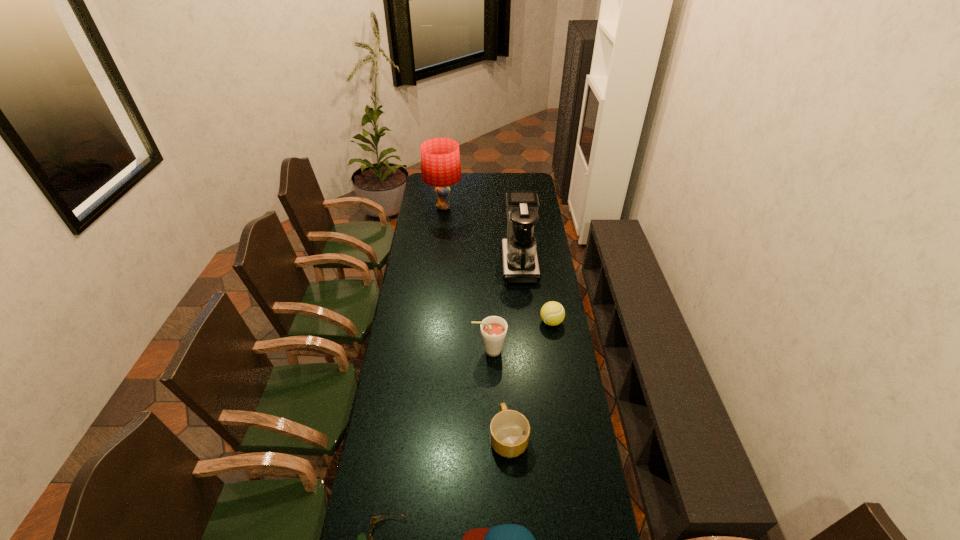
At what (x,y) coordinates should I click in order to perform the action: click on vacant space at the left edge of the desktop. Please return your answer as a coordinate pair (x, y). The width and height of the screenshot is (960, 540). Looking at the image, I should click on (424, 396).

Identify the location of vacant space at the right edge of the desktop. (566, 355).

Locate an element on the screen. Image resolution: width=960 pixels, height=540 pixels. free space that is in between the farthest object and the mug is located at coordinates (476, 322).

The height and width of the screenshot is (540, 960). I want to click on vacant space that is in between the farthest object and the second farthest object, so click(x=481, y=235).

The width and height of the screenshot is (960, 540). I want to click on unoccupied position between the fifth farthest object and the coffee maker, so click(514, 350).

The width and height of the screenshot is (960, 540). Find the location of `free space between the fifth farthest object and the tennis ball`. free space between the fifth farthest object and the tennis ball is located at coordinates (530, 379).

You are a GUI agent. You are given a task and a screenshot of the screen. Output one action in this format:
    pyautogui.click(x=<x>, y=<y>)
    Task: Click on the empty location between the third tallest object and the lampshade
    This screenshot has height=540, width=960.
    Given the screenshot: What is the action you would take?
    pyautogui.click(x=467, y=279)

This screenshot has width=960, height=540. Find the location of `object that is the fifth closest to the fifth farthest object`. object that is the fifth closest to the fifth farthest object is located at coordinates (519, 255).

You are a GUI agent. You are given a task and a screenshot of the screen. Output one action in this format:
    pyautogui.click(x=<x>, y=<y>)
    Task: Click on the object that is the third nearest to the third nearest object
    The width and height of the screenshot is (960, 540).
    Given the screenshot: What is the action you would take?
    pyautogui.click(x=362, y=539)

Find the location of a particular element. Image resolution: width=960 pixels, height=540 pixels. free space that satisfies the following two spatial constraints: 1. on the side with the handle of the mug; 2. on the left side of the fifth nearest object is located at coordinates (503, 322).